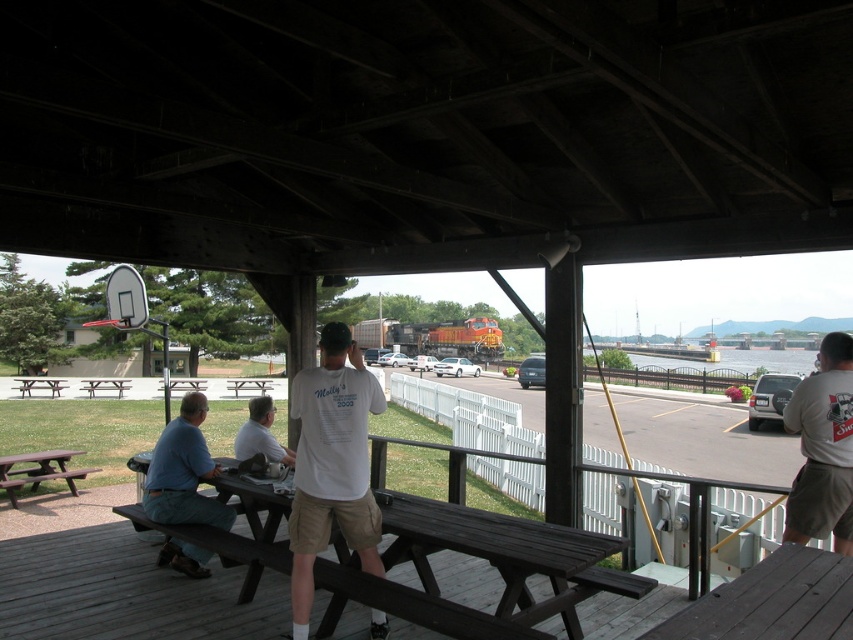
Is dark brown wood deck at lower right to the right of brown wooden picnic table at left from the viewer's perspective?

Yes, dark brown wood deck at lower right is to the right of brown wooden picnic table at left.

Does point (842, 637) come behind point (45, 387)?

No, it is not.

Find the location of a particular element. This screenshot has width=853, height=640. dark brown wood deck at lower right is located at coordinates (772, 602).

Which is behind, point (297, 401) or point (50, 387)?

Positioned behind is point (50, 387).

Is point (369, 531) positioned after point (55, 390)?

No, it is in front of (55, 390).

Locate an element on the screen. This screenshot has width=853, height=640. white cotton t-shirt at center is located at coordinates (331, 465).

Who is shorter, white cotton shirt at center or blue cotton shirt at lower left?

Standing shorter between the two is blue cotton shirt at lower left.

Can you confirm if white cotton shirt at center is wider than blue cotton shirt at lower left?

Indeed, white cotton shirt at center has a greater width compared to blue cotton shirt at lower left.

Does point (289, 534) lie behind point (178, 499)?

No, (289, 534) is in front of (178, 499).

Identify the location of white cotton shirt at center. The height and width of the screenshot is (640, 853). (332, 465).